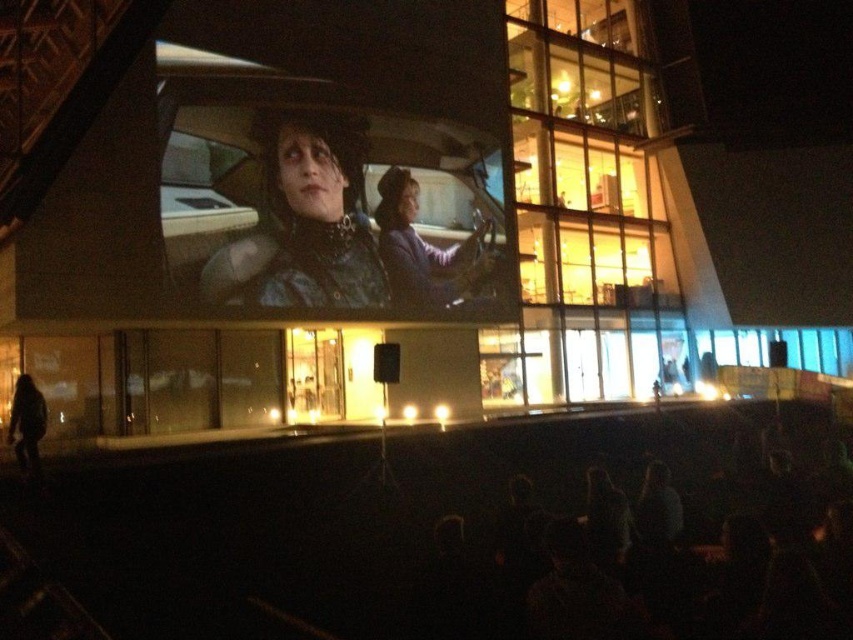
Question: Which point is farther to the camera?

Choices:
 (A) purple fabric jacket at center
 (B) matte black leather car at center
 (C) dark textured coat at lower left
 (D) leather jacket at center

Answer: (A)

Question: Does matte black leather car at center have a smaller size compared to purple fabric jacket at center?

Choices:
 (A) no
 (B) yes

Answer: (A)

Question: Can you confirm if leather jacket at center is positioned to the left of dark textured coat at lower left?

Choices:
 (A) yes
 (B) no

Answer: (B)

Question: Can you confirm if leather jacket at center is positioned above dark textured coat at lower left?

Choices:
 (A) no
 (B) yes

Answer: (B)

Question: Which object appears farthest from the camera in this image?

Choices:
 (A) matte black leather car at center
 (B) purple fabric jacket at center
 (C) dark textured coat at lower left

Answer: (B)

Question: Among these objects, which one is nearest to the camera?

Choices:
 (A) purple fabric jacket at center
 (B) matte black leather car at center
 (C) leather jacket at center

Answer: (B)